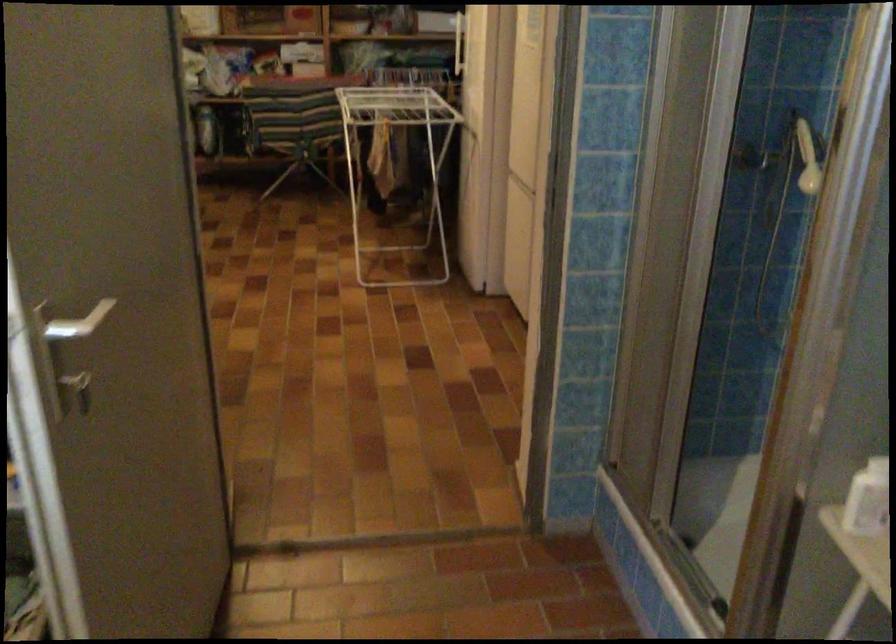
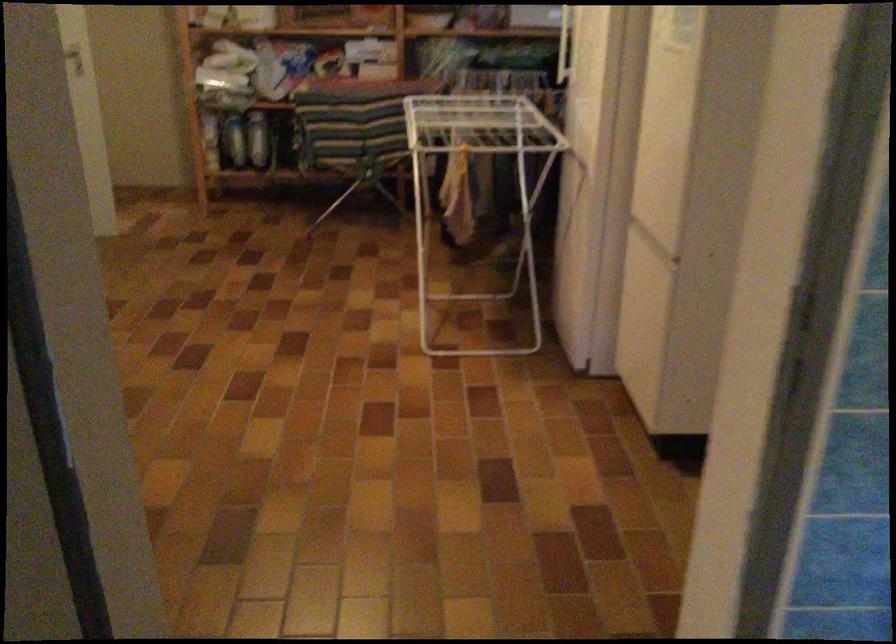
Question: The images are taken continuously from a first-person perspective. In which direction are you moving?

Choices:
 (A) Left
 (B) Right
 (C) Forward
 (D) Backward

Answer: (C)